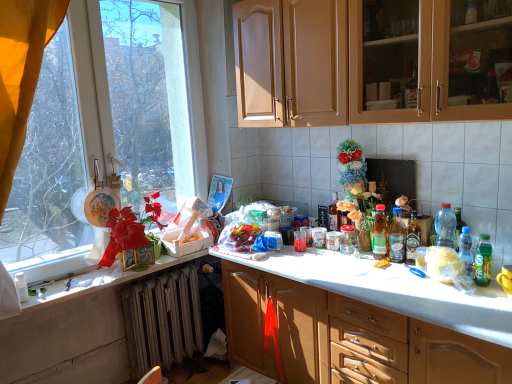
Find the location of a particular element. The width and height of the screenshot is (512, 384). gray metallic radiator at lower left is located at coordinates (162, 319).

How much space does translucent plastic bottle at right, which ranks as the fourth bottle in left-to-right order, occupy vertically?

translucent plastic bottle at right, which ranks as the fourth bottle in left-to-right order, is 11.07 inches tall.

At what (x,y) coordinates should I click in order to perform the action: click on translucent plastic bottle at right, marked as the fifth bottle in a back-to-front arrangement. Please return your answer as a coordinate pair (x, y). Image resolution: width=512 pixels, height=384 pixels. Looking at the image, I should click on (466, 250).

What do you see at coordinates (379, 233) in the screenshot? I see `translucent glass bottle at center, which ranks as the 5th bottle in right-to-left order` at bounding box center [379, 233].

Find the location of a particular element. gray metallic radiator at lower left is located at coordinates (162, 319).

From the image's perspective, would you say matte wood cabinets at upper center, marked as the 2th cabinetry in a bottom-to-top arrangement, is positioned over gray metallic radiator at lower left?

Indeed, from the image's perspective, matte wood cabinets at upper center, marked as the 2th cabinetry in a bottom-to-top arrangement, is shown above gray metallic radiator at lower left.

Is matte wood cabinets at upper center, marked as the 2th cabinetry in a bottom-to-top arrangement, facing away from gray metallic radiator at lower left?

matte wood cabinets at upper center, marked as the 2th cabinetry in a bottom-to-top arrangement, does not have its back to gray metallic radiator at lower left.

How different are the orientations of matte wood cabinets at upper center, acting as the first cabinetry starting from the top, and gray metallic radiator at lower left in degrees?

92.4 degrees separate the facing orientations of matte wood cabinets at upper center, acting as the first cabinetry starting from the top, and gray metallic radiator at lower left.

From a real-world perspective, which object rests below the other?

gray metallic radiator at lower left.

Looking at the image, does translucent glass bottle at center, which ranks as the 2th bottle in left-to-right order, seem bigger or smaller compared to gray metallic radiator at lower left?

In the image, translucent glass bottle at center, which ranks as the 2th bottle in left-to-right order, appears to be smaller than gray metallic radiator at lower left.

Does translucent glass bottle at center, which ranks as the 2th bottle in left-to-right order, have a greater height compared to gray metallic radiator at lower left?

Incorrect, the height of translucent glass bottle at center, which ranks as the 2th bottle in left-to-right order, is not larger of that of gray metallic radiator at lower left.

From a real-world perspective, does translucent glass bottle at center, which ranks as the 5th bottle in right-to-left order, stand above gray metallic radiator at lower left?

Yes, from a real-world perspective, translucent glass bottle at center, which ranks as the 5th bottle in right-to-left order, is on top of gray metallic radiator at lower left.

Considering the sizes of objects translucent glass bottle at center, which is the sixth bottle from front to back, and green matte bottle at right, which is counted as the sixth bottle, starting from the left, in the image provided, who is wider, translucent glass bottle at center, which is the sixth bottle from front to back, or green matte bottle at right, which is counted as the sixth bottle, starting from the left,?

translucent glass bottle at center, which is the sixth bottle from front to back, is wider.

From a real-world perspective, who is located higher, translucent glass bottle at center, which is counted as the first bottle, starting from the back, or green matte bottle at right, which ranks as the 1th bottle in right-to-left order?

translucent glass bottle at center, which is counted as the first bottle, starting from the back, is physically above.

Do you think translucent glass bottle at center, which is counted as the first bottle, starting from the back, is within green matte bottle at right, which ranks as the 1th bottle in right-to-left order, or outside of it?

translucent glass bottle at center, which is counted as the first bottle, starting from the back, is spatially situated outside green matte bottle at right, which ranks as the 1th bottle in right-to-left order.

Considering the relative sizes of translucent glass bottle at center, the 1th bottle in the left-to-right sequence, and green matte bottle at right, acting as the 6th bottle starting from the back, in the image provided, is translucent glass bottle at center, the 1th bottle in the left-to-right sequence, taller than green matte bottle at right, acting as the 6th bottle starting from the back,?

No, translucent glass bottle at center, the 1th bottle in the left-to-right sequence, is not taller than green matte bottle at right, acting as the 6th bottle starting from the back.

Which is closer to the camera, (379, 220) or (85, 292)?

The point (85, 292) is more forward.

Which of these two, translucent glass bottle at center, which ranks as the 2th bottle in left-to-right order, or matte white counter top at left, is wider?

matte white counter top at left.

You are a GUI agent. You are given a task and a screenshot of the screen. Output one action in this format:
    pyautogui.click(x=<x>, y=<y>)
    Task: Click on the counter top below the translucent glass bottle at center, which ranks as the 2th bottle in left-to-right order (from a real-world perspective)
    The width and height of the screenshot is (512, 384).
    Given the screenshot: What is the action you would take?
    pyautogui.click(x=100, y=281)

What's the angular difference between translucent glass bottle at center, which is counted as the 2th bottle, starting from the back, and matte white counter top at left's facing directions?

89.8 degrees.

Would you consider matte brown cabinets at center, which ranks as the 1th cabinetry in bottom-to-top order, to be distant from translucent plastic bottle at right, arranged as the 5th bottle when viewed from the left?

They are positioned close to each other.

Which object is wider, matte brown cabinets at center, which ranks as the 1th cabinetry in bottom-to-top order, or translucent plastic bottle at right, marked as the 2th bottle in a right-to-left arrangement?

Wider between the two is matte brown cabinets at center, which ranks as the 1th cabinetry in bottom-to-top order.

Which of these two, matte brown cabinets at center, which appears as the 2th cabinetry when viewed from the top, or translucent plastic bottle at right, marked as the second bottle in a front-to-back arrangement, stands shorter?

Standing shorter between the two is translucent plastic bottle at right, marked as the second bottle in a front-to-back arrangement.

Is point (399, 348) less distant than point (458, 243)?

Yes.

From the image's perspective, which one is positioned lower, transparent glass window at upper left or translucent plastic bottle at right, which ranks as the fourth bottle in left-to-right order?

translucent plastic bottle at right, which ranks as the fourth bottle in left-to-right order, appears lower in the image.

Is transparent glass window at upper left looking in the opposite direction of translucent plastic bottle at right, which ranks as the fourth bottle in left-to-right order?

No, transparent glass window at upper left is not facing the opposite direction of translucent plastic bottle at right, which ranks as the fourth bottle in left-to-right order.

Is transparent glass window at upper left shorter than translucent plastic bottle at right, placed as the third bottle when sorted from right to left?

No, transparent glass window at upper left is not shorter than translucent plastic bottle at right, placed as the third bottle when sorted from right to left.

Would you say translucent plastic bottle at right, the 4th bottle positioned from the back, is part of transparent glass window at upper left's contents?

No, transparent glass window at upper left does not contain translucent plastic bottle at right, the 4th bottle positioned from the back.

Visually, is translucent glass bottle at center, placed as the fourth bottle when sorted from right to left, positioned to the left or to the right of matte white counter top at left?

From the image, it's evident that translucent glass bottle at center, placed as the fourth bottle when sorted from right to left, is to the right of matte white counter top at left.

From a real-world perspective, relative to matte white counter top at left, is translucent glass bottle at center, marked as the third bottle in a left-to-right arrangement, vertically above or below?

translucent glass bottle at center, marked as the third bottle in a left-to-right arrangement, is situated higher than matte white counter top at left in the real world.

Is translucent glass bottle at center, which is counted as the third bottle, starting from the back, wider than matte white counter top at left?

No.

Where is `counter top in front of the translucent glass bottle at center, placed as the fourth bottle when sorted from right to left`? counter top in front of the translucent glass bottle at center, placed as the fourth bottle when sorted from right to left is located at coordinates coord(100,281).

The image size is (512, 384). Find the location of `radiator below the matte wood cabinets at upper center, acting as the first cabinetry starting from the top (from a real-world perspective)`. radiator below the matte wood cabinets at upper center, acting as the first cabinetry starting from the top (from a real-world perspective) is located at coordinates (162, 319).

Locate an element on the screen. This screenshot has width=512, height=384. radiator located on the left of translucent glass bottle at center, which is counted as the 2th bottle, starting from the back is located at coordinates (162, 319).

From the image, which object appears to be nearer to translucent plastic bottle at right, marked as the 2th bottle in a right-to-left arrangement, green matte bottle at right, which ranks as the 1th bottle in right-to-left order, or translucent glass bottle at center, placed as the fourth bottle when sorted from right to left?

green matte bottle at right, which ranks as the 1th bottle in right-to-left order.

Looking at the image, which one is located further to translucent glass bottle at center, which is counted as the third bottle, starting from the back, matte brown cabinets at center, which ranks as the 1th cabinetry in bottom-to-top order, or translucent plastic bottle at right, which ranks as the fourth bottle in left-to-right order?

The object further to translucent glass bottle at center, which is counted as the third bottle, starting from the back, is matte brown cabinets at center, which ranks as the 1th cabinetry in bottom-to-top order.

Estimate the real-world distances between objects in this image. Which object is further from matte white counter top at left, translucent plastic bottle at right, arranged as the 5th bottle when viewed from the left, or translucent plastic bottle at right, the 4th bottle positioned from the back?

Among the two, translucent plastic bottle at right, arranged as the 5th bottle when viewed from the left, is located further to matte white counter top at left.

Estimate the real-world distances between objects in this image. Which object is further from translucent glass bottle at center, the 1th bottle in the left-to-right sequence, translucent glass bottle at center, which is counted as the third bottle, starting from the back, or matte brown cabinets at center, which appears as the 2th cabinetry when viewed from the top?

matte brown cabinets at center, which appears as the 2th cabinetry when viewed from the top, lies further to translucent glass bottle at center, the 1th bottle in the left-to-right sequence, than the other object.

Based on their spatial positions, is translucent glass bottle at center, which is counted as the third bottle, starting from the back, or transparent glass window at upper left closer to matte white counter top at left?

transparent glass window at upper left is positioned closer to the anchor matte white counter top at left.

From the image, which object appears to be farther from translucent plastic bottle at right, the 4th bottle positioned from the back, green matte bottle at right, acting as the 6th bottle starting from the back, or translucent glass bottle at center, the 1th bottle in the left-to-right sequence?

Based on the image, translucent glass bottle at center, the 1th bottle in the left-to-right sequence, appears to be further to translucent plastic bottle at right, the 4th bottle positioned from the back.

When comparing their distances from matte wood cabinets at upper center, acting as the first cabinetry starting from the top, does gray metallic radiator at lower left or translucent glass bottle at center, placed as the sixth bottle when sorted from right to left, seem further?

gray metallic radiator at lower left.

Looking at the image, which one is located closer to matte brown cabinets at center, which appears as the 2th cabinetry when viewed from the top, transparent glass window at upper left or translucent glass bottle at center, which ranks as the 2th bottle in left-to-right order?

translucent glass bottle at center, which ranks as the 2th bottle in left-to-right order, is closer to matte brown cabinets at center, which appears as the 2th cabinetry when viewed from the top.

Locate an element on the screen. The image size is (512, 384). counter top between transparent glass window at upper left and green matte bottle at right, which is counted as the sixth bottle, starting from the left is located at coordinates pyautogui.click(x=100, y=281).

This screenshot has height=384, width=512. In order to click on radiator between transparent glass window at upper left and matte brown cabinets at center, which appears as the 2th cabinetry when viewed from the top, in the horizontal direction in this screenshot , I will do `click(162, 319)`.

The image size is (512, 384). I want to click on bottle located between transparent glass window at upper left and translucent glass bottle at center, which ranks as the 5th bottle in right-to-left order, in the left-right direction, so click(334, 214).

Locate an element on the screen. radiator situated between matte white counter top at left and matte brown cabinets at center, which appears as the 2th cabinetry when viewed from the top, from left to right is located at coordinates (162, 319).